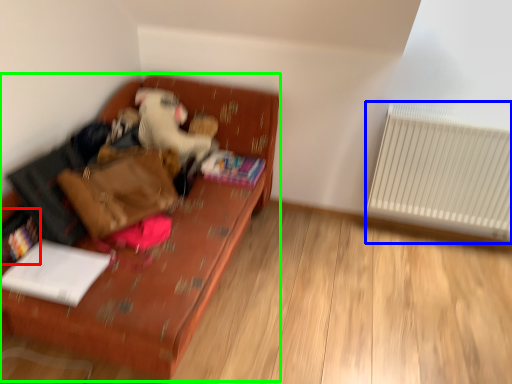
Question: Based on their relative distances, which object is farther from book (highlighted by a red box)? Choose from radiator (highlighted by a blue box) and furniture (highlighted by a green box).

Choices:
 (A) radiator
 (B) furniture

Answer: (A)